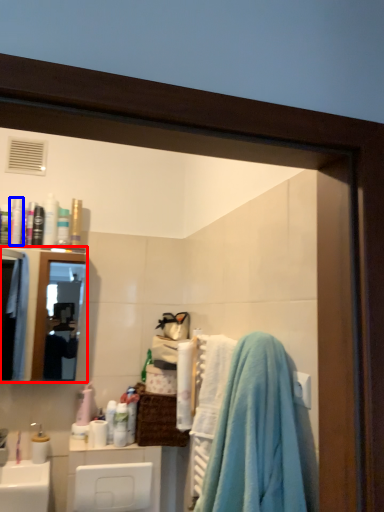
Question: Which point is further to the camera, mirror (highlighted by a red box) or toiletry (highlighted by a blue box)?

Choices:
 (A) mirror
 (B) toiletry

Answer: (B)